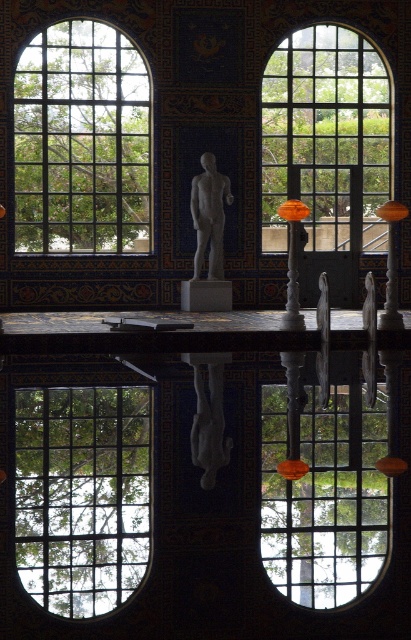
Is point (122, 579) closer to viewer compared to point (223, 266)?

Yes, it is in front of point (223, 266).

I want to click on clear glass window at center, so click(82, 496).

Is point (48, 506) positioned in front of point (205, 212)?

Yes, it is.

Locate an element on the screen. The width and height of the screenshot is (411, 640). clear glass window at center is located at coordinates (82, 496).

Is white glossy statue at center taller than orange glass pillar at right?

No.

I want to click on white glossy statue at center, so click(209, 417).

Who is more distant from viewer, (55, 161) or (196, 289)?

The point (55, 161) is behind.

Who is lower down, clear glass window at upper left or white marble pillar at center?

white marble pillar at center is lower down.

Is point (126, 200) in front of point (189, 305)?

No, it is behind (189, 305).

Where is `clear glass window at upper left`? clear glass window at upper left is located at coordinates (82, 141).